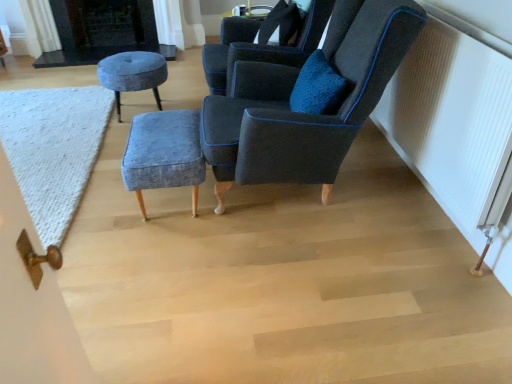
The height and width of the screenshot is (384, 512). I want to click on vacant area that is in front of velvet dark blue chair at upper right, which is counted as the first chair, starting from the front, so click(304, 286).